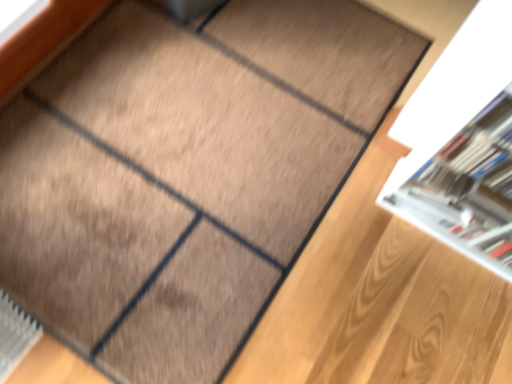
This screenshot has height=384, width=512. Describe the element at coordinates (462, 143) in the screenshot. I see `white glossy bookcase at upper right` at that location.

Looking at this image, measure the distance between point (469, 102) and camera.

Point (469, 102) is 36.50 inches away from camera.

This screenshot has width=512, height=384. I want to click on white glossy bookcase at upper right, so click(x=462, y=143).

Locate an element on the screen. This screenshot has width=512, height=384. white glossy bookcase at upper right is located at coordinates (x=462, y=143).